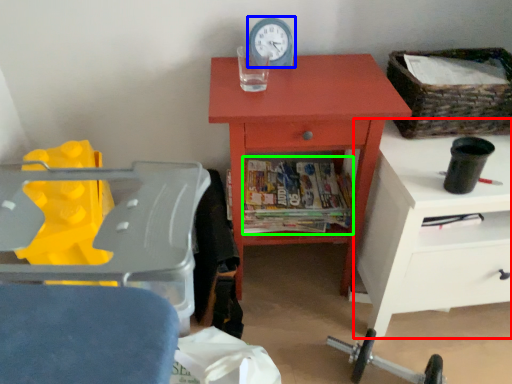
Question: Based on their relative distances, which object is farther from nightstand (highlighted by a red box)? Choose from clock (highlighted by a blue box) and magazine (highlighted by a green box).

Choices:
 (A) clock
 (B) magazine

Answer: (A)